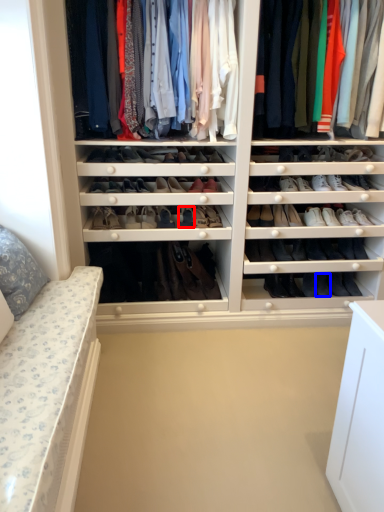
Question: Which of the following is the closest to the observer, shoe (highlighted by a red box) or shoe (highlighted by a blue box)?

Choices:
 (A) shoe
 (B) shoe

Answer: (A)